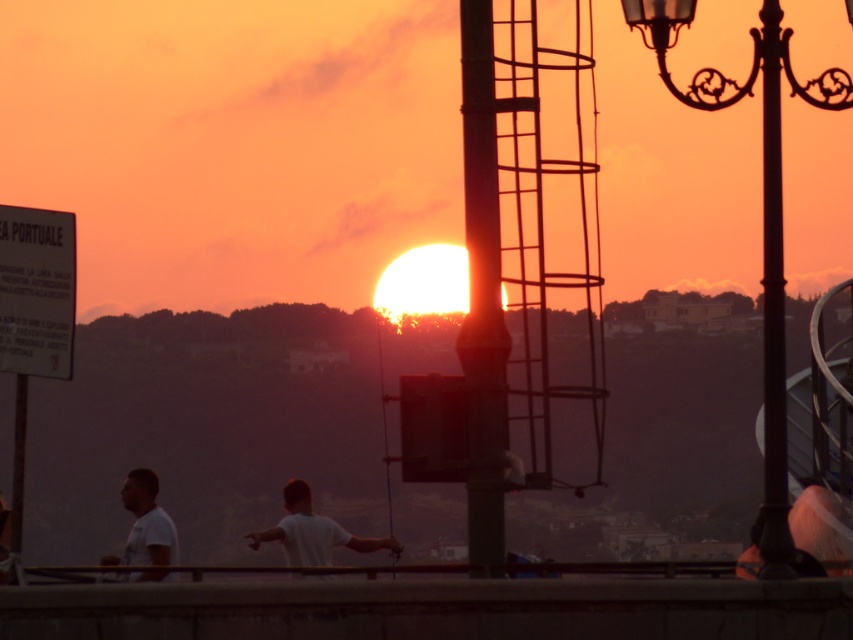
Based on the photo, you are standing on the waterfront promenade and want to take a photo of the sunset with both the black wrought iron lamp post at upper right and the black metal pole at right in the frame. Which object should you position closer to the camera to ensure both are fully visible in the photo?

You should position the black wrought iron lamp post at upper right closer to the camera since it is much taller than the black metal pole at right. This will help ensure both objects are fully visible in the photo without one being cut off due to its height.

You are standing at the waterfront promenade where the sunset is happening. You want to take a photo of the white matte shirt at center and the black metal pole at right in the same frame. The camera you have can focus on objects up to 50 meters away. Will both objects be in focus?

The black metal pole at right is 48.69 meters away from the white matte shirt at center. Since the camera can focus up to 50 meters, both objects will be within the focus range and can be captured in the same frame.